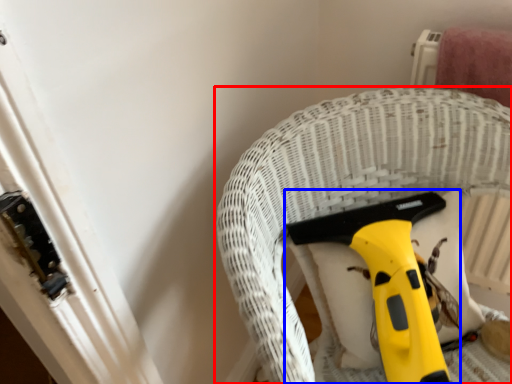
Question: Which object is closer to the camera taking this photo, furniture (highlighted by a red box) or tool (highlighted by a blue box)?

Choices:
 (A) furniture
 (B) tool

Answer: (A)